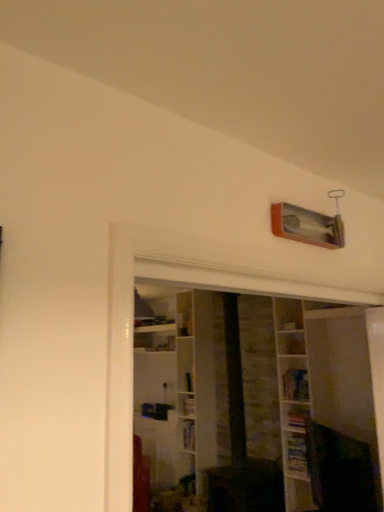
Question: Do you think hardcover book at upper center, the 3th book positioned from the bottom, is within hardcover book at lower right, positioned as the 1th book in bottom-to-top order, or outside of it?

Choices:
 (A) inside
 (B) outside

Answer: (B)

Question: From the image's perspective, is hardcover book at upper center, the 3th book positioned from the bottom, positioned above or below hardcover book at lower right, positioned as the 1th book in bottom-to-top order?

Choices:
 (A) above
 (B) below

Answer: (A)

Question: Estimate the real-world distances between objects in this image. Which object is closer to the hardcover book at lower right, positioned as the 1th book in bottom-to-top order?

Choices:
 (A) hardcover book at upper center, which appears as the 1th book when viewed from the top
 (B) white wooden shelf at center
 (C) hardcover book at lower right, positioned as the second book in bottom-to-top order

Answer: (C)

Question: Considering the real-world distances, which object is farthest from the hardcover book at lower right, the 3th book from the top?

Choices:
 (A) white wooden shelf at center
 (B) hardcover book at upper center, which appears as the 1th book when viewed from the top
 (C) hardcover book at lower right, placed as the second book when sorted from top to bottom

Answer: (B)